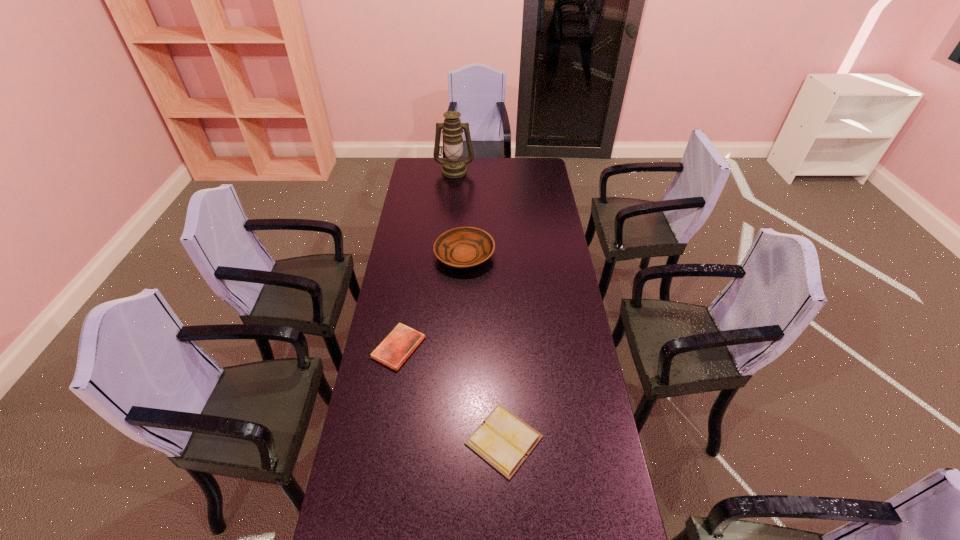
Where is `object identified as the second closest to the left diary`? The image size is (960, 540). object identified as the second closest to the left diary is located at coordinates (463, 247).

Identify which object is the third nearest to the oil lamp. Please provide its 2D coordinates. Your answer should be formatted as a tuple, i.e. [(x, y)], where the tuple contains the x and y coordinates of a point satisfying the conditions above.

[(503, 440)]

Identify the location of vacant space that satisfies the following two spatial constraints: 1. on the front side of the tallest object; 2. on the right side of the second farthest object. (447, 256).

Image resolution: width=960 pixels, height=540 pixels. Find the location of `vacant position in the image that satisfies the following two spatial constraints: 1. on the back side of the oil lamp; 2. on the right side of the left diary`. vacant position in the image that satisfies the following two spatial constraints: 1. on the back side of the oil lamp; 2. on the right side of the left diary is located at coordinates (428, 170).

Identify the location of vacant position in the image that satisfies the following two spatial constraints: 1. on the front side of the shorter diary; 2. on the right side of the nearer diary. (384, 440).

What are the coordinates of `vacant space that satisfies the following two spatial constraints: 1. on the back side of the second tallest object; 2. on the left side of the second nearest object` in the screenshot? It's located at (414, 256).

Where is `vacant region that satisfies the following two spatial constraints: 1. on the back side of the shorter diary; 2. on the left side of the plate`? The image size is (960, 540). vacant region that satisfies the following two spatial constraints: 1. on the back side of the shorter diary; 2. on the left side of the plate is located at coordinates (414, 256).

Where is `free location that satisfies the following two spatial constraints: 1. on the front side of the second farthest object; 2. on the left side of the tallest object`? This screenshot has height=540, width=960. free location that satisfies the following two spatial constraints: 1. on the front side of the second farthest object; 2. on the left side of the tallest object is located at coordinates (447, 256).